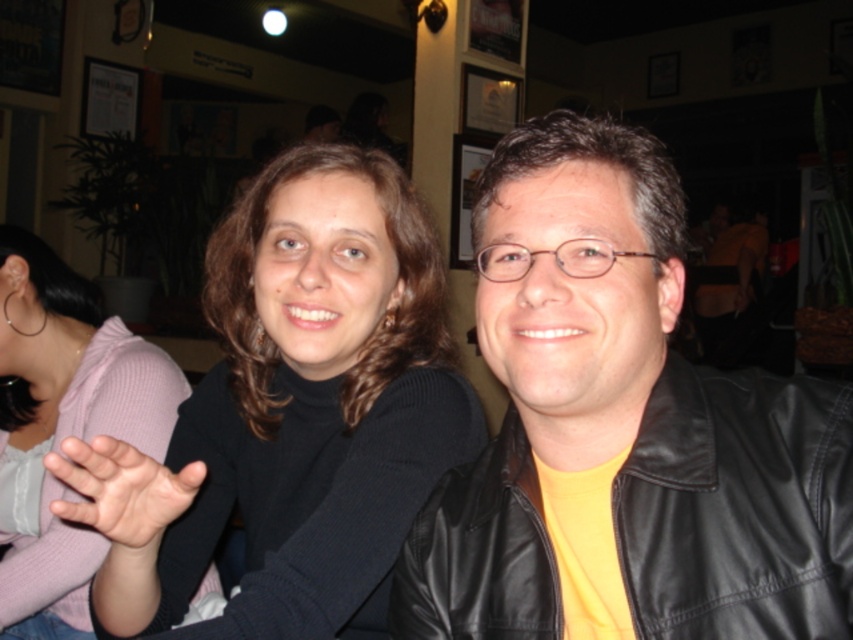
Question: Which of the following is the farthest from the observer?

Choices:
 (A) pink soft skin at center
 (B) black leather jacket at right
 (C) black turtleneck sweater at center
 (D) matte black sweater at center

Answer: (D)

Question: Which of the following is the closest to the observer?

Choices:
 (A) pink soft skin at center
 (B) black turtleneck sweater at center
 (C) matte black sweater at center
 (D) black leather jacket at right

Answer: (A)

Question: Is the position of black turtleneck sweater at center less distant than that of pink soft skin at center?

Choices:
 (A) yes
 (B) no

Answer: (B)

Question: Does matte black sweater at center appear on the left side of pink soft skin at center?

Choices:
 (A) yes
 (B) no

Answer: (A)

Question: Which point is closer to the camera taking this photo?

Choices:
 (A) (706, 468)
 (B) (90, 502)
 (C) (30, 292)
 (D) (432, 314)

Answer: (A)

Question: Does black leather jacket at right have a smaller size compared to pink soft skin at center?

Choices:
 (A) no
 (B) yes

Answer: (A)